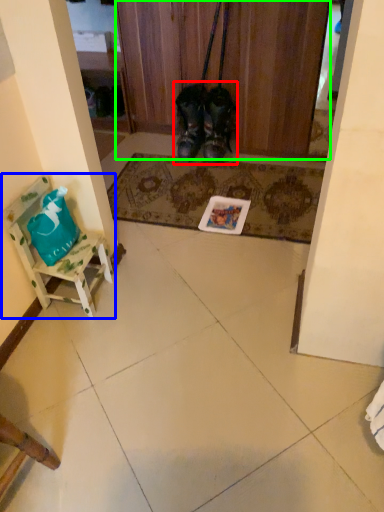
Question: Which object is positioned closest to footwear (highlighted by a red box)? Select from furniture (highlighted by a blue box) and door (highlighted by a green box).

Choices:
 (A) furniture
 (B) door

Answer: (B)